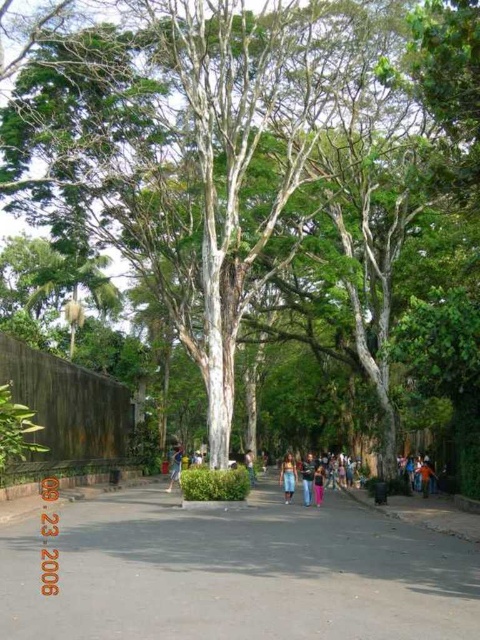
You are a pedestrian walking along the pathway and see the gray asphalt pavement at center and the light brown leather jacket at center. Which object takes up more space in the scene?

The gray asphalt pavement at center is larger in size than the light brown leather jacket at center, so it takes up more space in the scene.

You are standing on the pathway and see both the pink fabric pants at center and the orange fabric person at center. Which object is positioned lower in the image?

The pink fabric pants at center is located below the orange fabric person at center, so it is positioned lower in the image.

From the picture: You are a delivery person carrying a package that requires a 2 meter wide path to navigate safely. You see the blue denim jeans at center and the pink fabric pants at center in the pathway. Can you pass through the pathway between them without needing to move the objects?

The distance between blue denim jeans at center and pink fabric pants at center is 3.50 meters, which is wider than the required 2 meters. Therefore, you can safely pass through the pathway between them without moving the objects.